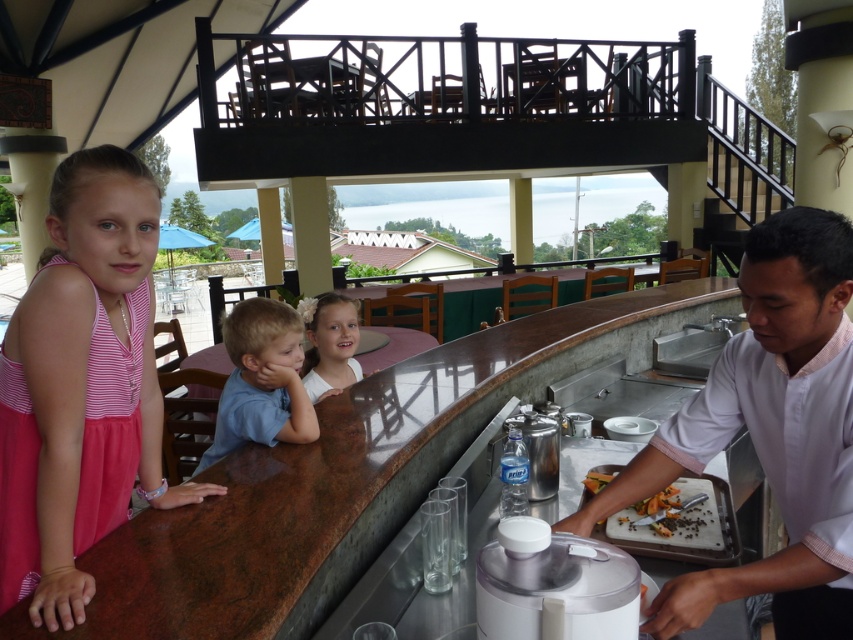
Who is taller, white plastic blender at lower center or blue cotton shirt at center?

With more height is blue cotton shirt at center.

Is point (566, 627) positioned in front of point (239, 323)?

Yes, point (566, 627) is in front of point (239, 323).

Identify the location of white plastic blender at lower center. (554, 586).

Can you confirm if white shirt at right is positioned below marble countertop at center?

No, white shirt at right is not below marble countertop at center.

Who is more forward, (782, 422) or (381, 563)?

Point (782, 422) is in front.

Find the location of `white shirt at right`. white shirt at right is located at coordinates (770, 433).

Does dark brown wooden cutting board at right come behind dark brown wooden tray at lower right?

No, it is not.

Does dark brown wooden cutting board at right have a greater height compared to dark brown wooden tray at lower right?

Yes.

Is point (699, 512) more distant than point (621, 516)?

No, it is in front of (621, 516).

I want to click on dark brown wooden cutting board at right, so [x=676, y=520].